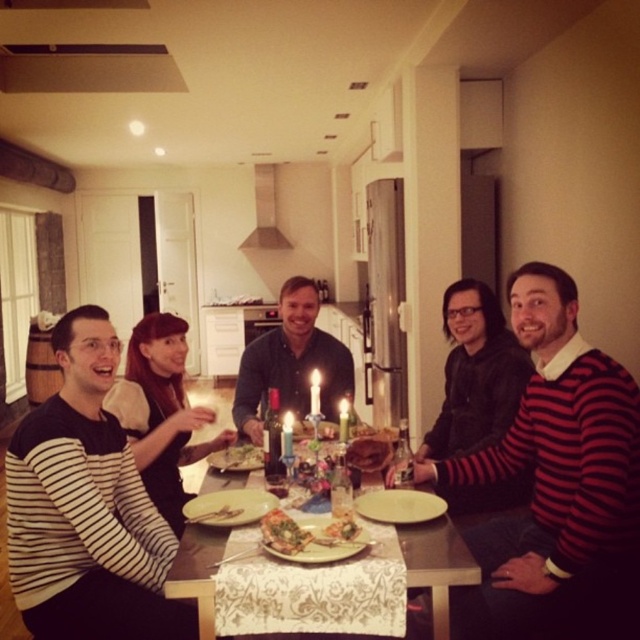
Question: Does matte dark blue shirt at center appear over white wax candle at center?

Choices:
 (A) yes
 (B) no

Answer: (B)

Question: Which of the following is the closest to the observer?

Choices:
 (A) (77, 403)
 (B) (596, 458)

Answer: (B)

Question: Which of the following is the closest to the observer?

Choices:
 (A) (291, 422)
 (B) (275, 532)
 (C) (160, 593)
 (D) (630, 609)

Answer: (B)

Question: Can you confirm if wooden table at center is thinner than white wax candle at center?

Choices:
 (A) yes
 (B) no

Answer: (B)

Question: Which object appears closest to the camera in this image?

Choices:
 (A) striped sweater at center
 (B) striped sweater at left

Answer: (A)

Question: Can you confirm if striped sweater at center is positioned above green wax candle at center?

Choices:
 (A) yes
 (B) no

Answer: (B)